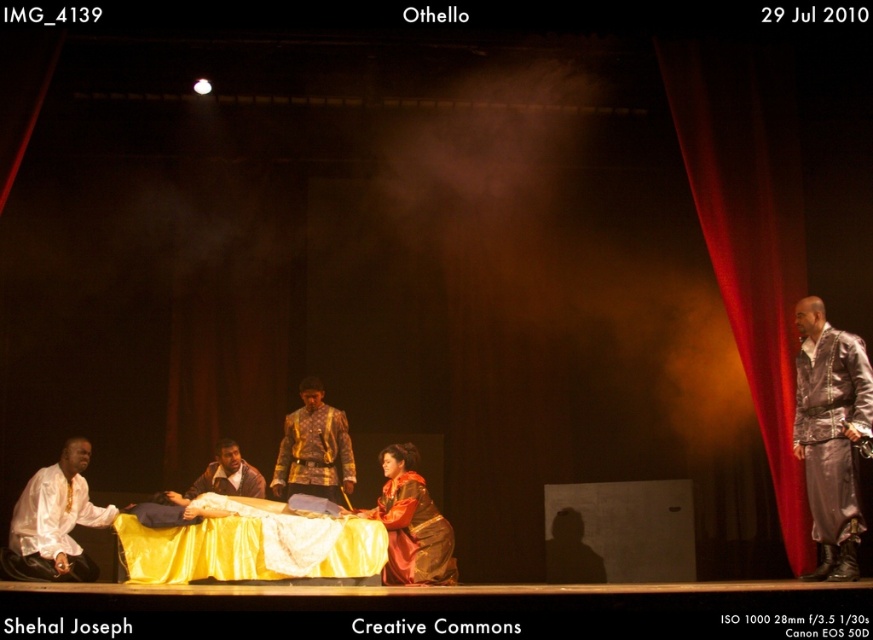
Question: Is red velvet curtain at right further to camera compared to gold textured jacket at center?

Choices:
 (A) no
 (B) yes

Answer: (A)

Question: Which object is positioned farthest from the shiny silver suit at right?

Choices:
 (A) brown leather jacket at center
 (B) gold textured jacket at center
 (C) white satin shirt at lower left

Answer: (C)

Question: Is white satin shirt at lower left to the right of gold textured jacket at center from the viewer's perspective?

Choices:
 (A) yes
 (B) no

Answer: (B)

Question: Does shiny silver suit at right have a lesser width compared to brown leather jacket at center?

Choices:
 (A) no
 (B) yes

Answer: (B)

Question: Which point appears closest to the camera in this image?

Choices:
 (A) pyautogui.click(x=238, y=468)
 (B) pyautogui.click(x=320, y=483)
 (C) pyautogui.click(x=730, y=321)
 (D) pyautogui.click(x=815, y=378)

Answer: (D)

Question: Which point is farther to the camera?

Choices:
 (A) (720, 138)
 (B) (810, 433)
 (C) (395, 520)
 (D) (303, 449)

Answer: (D)